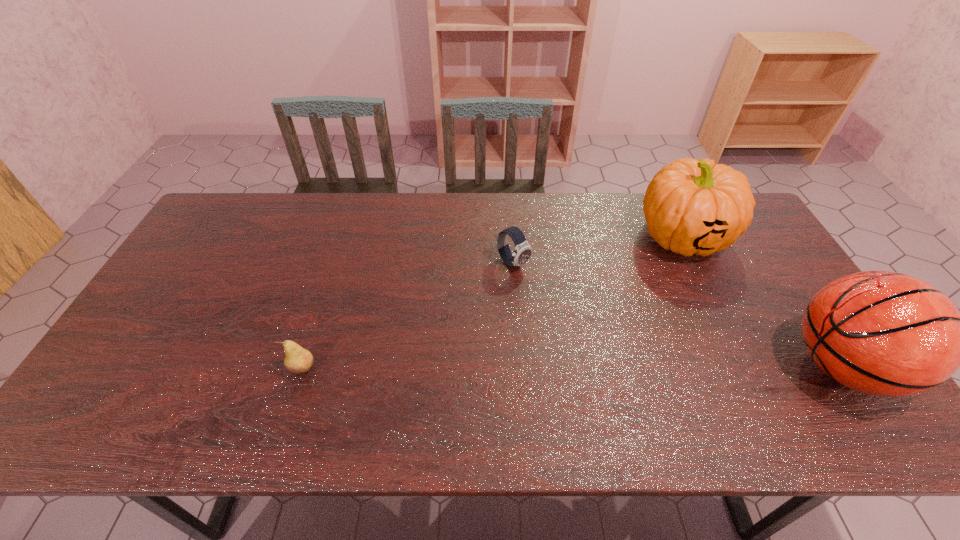
Locate an element on the screen. free spot on the desktop that is between the pear and the basketball and is positioned on the face of the second object from left to right is located at coordinates (636, 367).

The width and height of the screenshot is (960, 540). I want to click on vacant space on the desktop that is between the leftmost object and the basketball and is positioned on the surface of the pumpkin, so click(x=525, y=368).